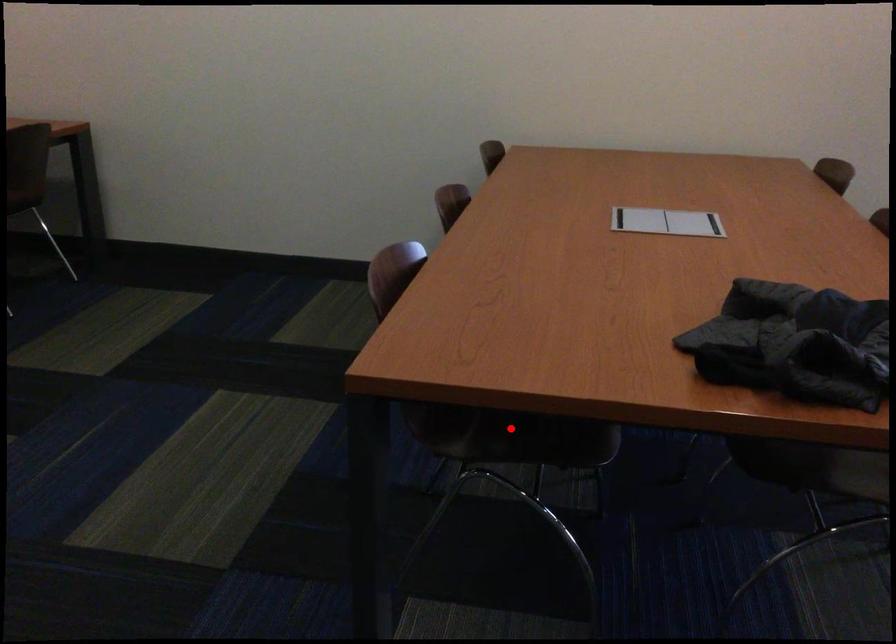
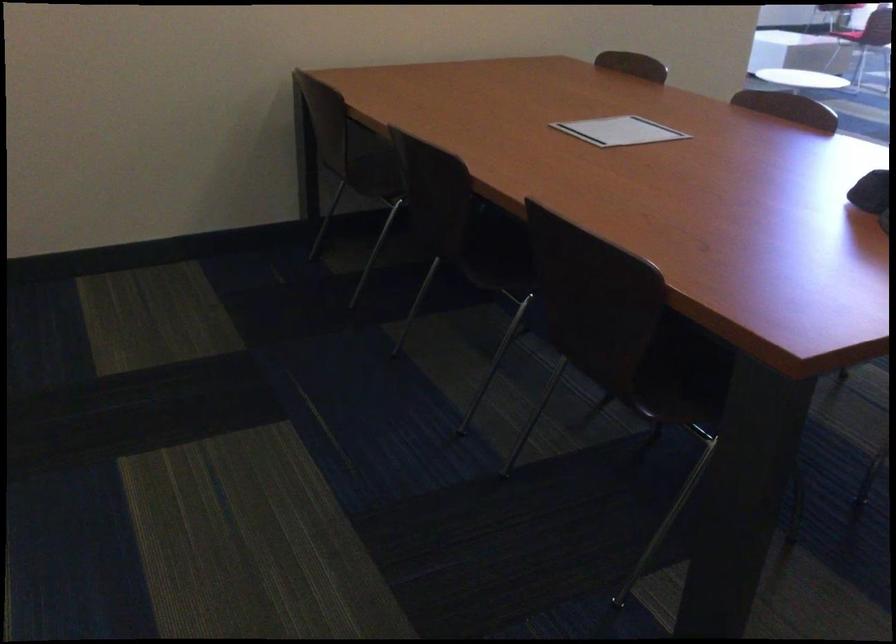
The point at the highlighted location is marked in the first image. Where is the corresponding point in the second image?

(684, 375)